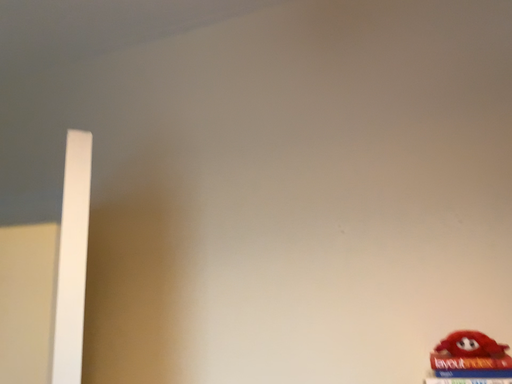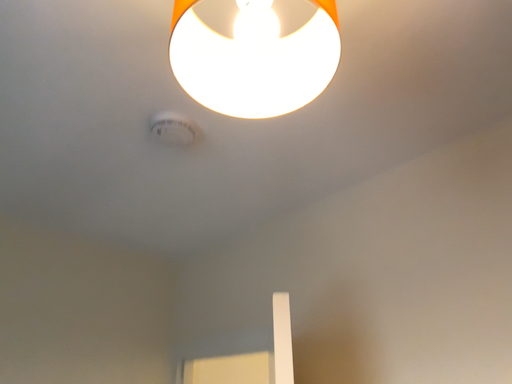
Question: How did the camera likely rotate when shooting the video?

Choices:
 (A) rotated left
 (B) rotated right

Answer: (A)